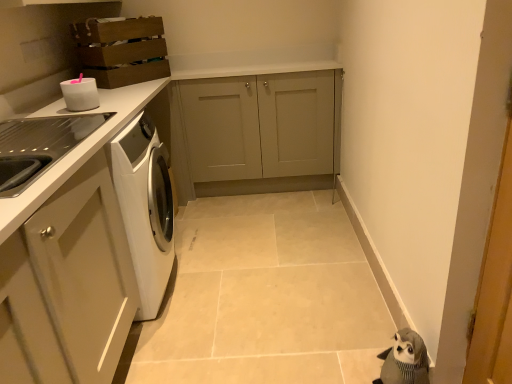
Image resolution: width=512 pixels, height=384 pixels. Describe the element at coordinates (39, 146) in the screenshot. I see `white glossy sink at left` at that location.

What do you see at coordinates (78, 152) in the screenshot?
I see `white glossy countertop at left` at bounding box center [78, 152].

In order to face white glossy countertop at left, should I rotate leftwards or rightwards?

Rotate your view left by about 20.425°.

Identify the location of wooden crate at upper left, the second cabinetry when ordered from right to left. The width and height of the screenshot is (512, 384). (121, 50).

From the image's perspective, which is below, white glossy sink at left or white glossy countertop at left?

white glossy countertop at left is shown below in the image.

From a real-world perspective, who is located lower, white glossy sink at left or white glossy countertop at left?

From a 3D spatial view, white glossy countertop at left is below.

Is white glossy sink at left inside or outside of white glossy countertop at left?

white glossy sink at left is enclosed within white glossy countertop at left.

Is white glossy countertop at left a part of white glossy container at upper left?

No, white glossy countertop at left is not a part of white glossy container at upper left.

In the scene shown: Visually, is white glossy container at upper left positioned to the left or to the right of white glossy countertop at left?

Clearly, white glossy container at upper left is on the left of white glossy countertop at left in the image.

Are white glossy container at upper left and white glossy countertop at left making contact?

white glossy container at upper left and white glossy countertop at left are not in contact.

Is white glossy container at upper left turned away from white glossy countertop at left?

No, white glossy container at upper left is not facing away from white glossy countertop at left.

Is white glossy sink at left thinner than white glossy container at upper left?

Incorrect, the width of white glossy sink at left is not less than that of white glossy container at upper left.

Which point is more distant from viewer, (x=62, y=132) or (x=95, y=103)?

The point (x=95, y=103) is farther.

Could you tell me if white glossy sink at left is turned towards white glossy container at upper left?

No, white glossy sink at left is not facing towards white glossy container at upper left.

Looking at the image, does white glossy sink at left seem bigger or smaller compared to white glossy container at upper left?

Considering their sizes, white glossy sink at left takes up more space than white glossy container at upper left.

Considering the relative sizes of white glossy container at upper left and white glossy sink at left in the image provided, is white glossy container at upper left smaller than white glossy sink at left?

Yes.

Which is correct: white glossy container at upper left is inside white glossy sink at left, or outside of it?

white glossy container at upper left cannot be found inside white glossy sink at left.

Between white glossy container at upper left and white glossy sink at left, which one has larger width?

Wider between the two is white glossy sink at left.

Looking at this image, is white glossy container at upper left to the right of white glossy sink at left from the viewer's perspective?

Indeed, white glossy container at upper left is positioned on the right side of white glossy sink at left.

Is matte gray cabinet at center, placed as the first cabinetry when sorted from right to left, wider than white glossy container at upper left?

Correct, the width of matte gray cabinet at center, placed as the first cabinetry when sorted from right to left, exceeds that of white glossy container at upper left.

In terms of height, does matte gray cabinet at center, the second cabinetry viewed from the left, look taller or shorter compared to white glossy container at upper left?

Considering their sizes, matte gray cabinet at center, the second cabinetry viewed from the left, has more height than white glossy container at upper left.

Would you say matte gray cabinet at center, placed as the first cabinetry when sorted from right to left, is inside or outside white glossy container at upper left?

matte gray cabinet at center, placed as the first cabinetry when sorted from right to left, cannot be found inside white glossy container at upper left.

What's the angular difference between matte gray cabinet at center, the second cabinetry viewed from the left, and white glossy container at upper left's facing directions?

The angular difference between matte gray cabinet at center, the second cabinetry viewed from the left, and white glossy container at upper left is 89.7 degrees.

From the image's perspective, relative to wooden crate at upper left, the second cabinetry when ordered from right to left, is matte gray cabinet at center, the second cabinetry viewed from the left, above or below?

matte gray cabinet at center, the second cabinetry viewed from the left, is below wooden crate at upper left, the second cabinetry when ordered from right to left.

Identify the location of cabinetry that appears below the wooden crate at upper left, the 1th cabinetry from the left (from a real-world perspective). (255, 129).

Is point (234, 121) less distant than point (154, 37)?

No.

From a real-world perspective, is matte gray cabinet at center, placed as the first cabinetry when sorted from right to left, physically below wooden crate at upper left, the second cabinetry when ordered from right to left?

Yes.

Can you see white glossy sink at left touching wooden crate at upper left, the second cabinetry when ordered from right to left?

No, white glossy sink at left is not in contact with wooden crate at upper left, the second cabinetry when ordered from right to left.

Is white glossy sink at left at the right side of wooden crate at upper left, the 1th cabinetry from the left?

No, white glossy sink at left is not to the right of wooden crate at upper left, the 1th cabinetry from the left.

From the picture: Considering the relative sizes of white glossy sink at left and wooden crate at upper left, the 1th cabinetry from the left, in the image provided, is white glossy sink at left bigger than wooden crate at upper left, the 1th cabinetry from the left,?

Correct, white glossy sink at left is larger in size than wooden crate at upper left, the 1th cabinetry from the left.

From the image's perspective, which one is positioned higher, white glossy sink at left or wooden crate at upper left, the 1th cabinetry from the left?

wooden crate at upper left, the 1th cabinetry from the left, is shown above in the image.

The image size is (512, 384). In order to click on home appliance that appears in front of the white glossy countertop at left in this screenshot , I will do `click(39, 146)`.

You are a GUI agent. You are given a task and a screenshot of the screen. Output one action in this format:
    pyautogui.click(x=<x>, y=<y>)
    Task: Click on the countertop located on the right of white glossy container at upper left
    The image size is (512, 384).
    Given the screenshot: What is the action you would take?
    pyautogui.click(x=78, y=152)

Estimate the real-world distances between objects in this image. Which object is closer to matte gray cabinet at center, placed as the first cabinetry when sorted from right to left, white glossy container at upper left or white glossy sink at left?

white glossy container at upper left lies closer to matte gray cabinet at center, placed as the first cabinetry when sorted from right to left, than the other object.

Estimate the real-world distances between objects in this image. Which object is further from white glossy countertop at left, wooden crate at upper left, the second cabinetry when ordered from right to left, or matte gray cabinet at center, the second cabinetry viewed from the left?

The object further to white glossy countertop at left is matte gray cabinet at center, the second cabinetry viewed from the left.

Considering their positions, is wooden crate at upper left, the 1th cabinetry from the left, positioned further to matte gray cabinet at center, the second cabinetry viewed from the left, than white glossy sink at left?

Based on the image, white glossy sink at left appears to be further to matte gray cabinet at center, the second cabinetry viewed from the left.

From the image, which object appears to be farther from wooden crate at upper left, the 1th cabinetry from the left, white glossy countertop at left or white glossy sink at left?

white glossy sink at left.

Which object lies nearer to the anchor point matte gray cabinet at center, placed as the first cabinetry when sorted from right to left, white glossy container at upper left or wooden crate at upper left, the 1th cabinetry from the left?

The object closer to matte gray cabinet at center, placed as the first cabinetry when sorted from right to left, is wooden crate at upper left, the 1th cabinetry from the left.

When comparing their distances from white glossy container at upper left, does matte gray cabinet at center, placed as the first cabinetry when sorted from right to left, or wooden crate at upper left, the 1th cabinetry from the left, seem further?

Among the two, matte gray cabinet at center, placed as the first cabinetry when sorted from right to left, is located further to white glossy container at upper left.

Looking at the image, which one is located further to white glossy container at upper left, white glossy countertop at left or wooden crate at upper left, the second cabinetry when ordered from right to left?

The object further to white glossy container at upper left is wooden crate at upper left, the second cabinetry when ordered from right to left.

Looking at the image, which one is located further to white glossy sink at left, white glossy container at upper left or white glossy countertop at left?

white glossy container at upper left.

The image size is (512, 384). I want to click on appliance between white glossy sink at left and matte gray cabinet at center, placed as the first cabinetry when sorted from right to left, along the z-axis, so click(80, 94).

Image resolution: width=512 pixels, height=384 pixels. I want to click on countertop between white glossy sink at left and white glossy container at upper left from front to back, so click(x=78, y=152).

The image size is (512, 384). Identify the location of appliance between wooden crate at upper left, the second cabinetry when ordered from right to left, and matte gray cabinet at center, the second cabinetry viewed from the left, in the horizontal direction. (80, 94).

Identify the location of appliance between wooden crate at upper left, the 1th cabinetry from the left, and white glossy countertop at left vertically. Image resolution: width=512 pixels, height=384 pixels. (80, 94).